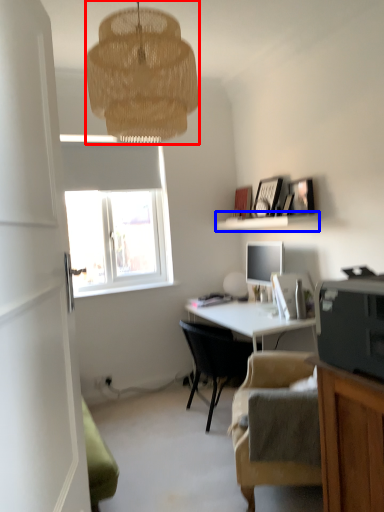
Question: Among these objects, which one is farthest to the camera, lamp (highlighted by a red box) or shelf (highlighted by a blue box)?

Choices:
 (A) lamp
 (B) shelf

Answer: (B)